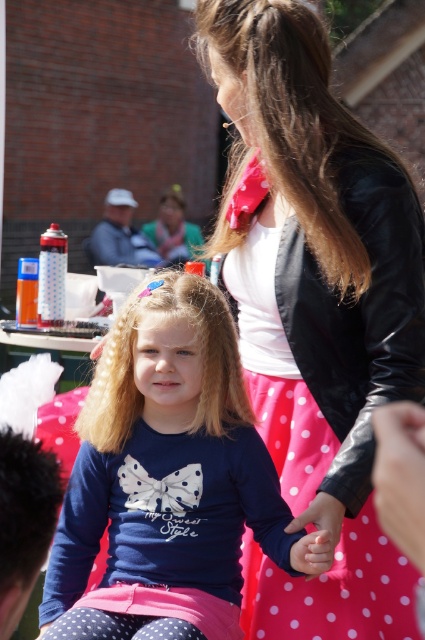
Question: Does matte black jacket at upper right appear on the right side of brown smooth hair at upper center?

Choices:
 (A) yes
 (B) no

Answer: (A)

Question: Is pink fabric hand at center below smooth skin hand at center?

Choices:
 (A) yes
 (B) no

Answer: (B)

Question: Which object is the farthest from the smooth skin hand at center?

Choices:
 (A) brown smooth hair at upper center
 (B) matte pink fabric at lower center

Answer: (A)

Question: Estimate the real-world distances between objects in this image. Which object is closer to the pink fabric hand at center?

Choices:
 (A) blondehair at center
 (B) matte black jacket at upper right
 (C) smooth skin hand at center

Answer: (C)

Question: Which object is closer to the camera taking this photo?

Choices:
 (A) blue matte shirt at center
 (B) matte black jacket at upper right
 (C) smooth skin hand at center
 (D) pink fabric hand at center

Answer: (D)

Question: Is pink fabric hand at center above smooth skin hand at center?

Choices:
 (A) yes
 (B) no

Answer: (A)